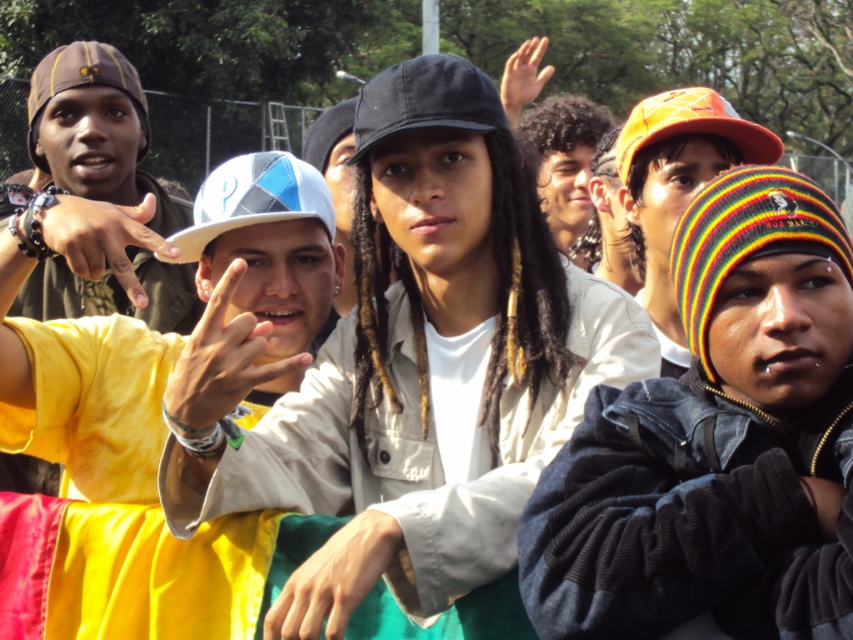
Does multicolor knitted beanie at center lie in front of black fabric baseball cap at center?

That is False.

How distant is multicolor knitted beanie at center from black fabric baseball cap at center?

multicolor knitted beanie at center is 1.24 meters away from black fabric baseball cap at center.

Between point (709, 154) and point (354, 109), which one is positioned behind?

The point (354, 109) is more distant.

The width and height of the screenshot is (853, 640). What are the coordinates of `multicolor knitted beanie at center` in the screenshot? It's located at (677, 179).

Is yellow cotton shirt at left to the left of matte brown beanie at left from the viewer's perspective?

No, yellow cotton shirt at left is not to the left of matte brown beanie at left.

Can you confirm if yellow cotton shirt at left is smaller than matte brown beanie at left?

No, yellow cotton shirt at left is not smaller than matte brown beanie at left.

Based on the photo, measure the distance between point (242,240) and camera.

14.71 feet

At what (x,y) coordinates should I click in order to perform the action: click on yellow cotton shirt at left. Please return your answer as a coordinate pair (x, y). Looking at the image, I should click on (88, 401).

Is point (206, 376) closer to viewer compared to point (381, 547)?

No, it is behind (381, 547).

Who is taller, matte yellow hand at center or smooth skin hand at center?

matte yellow hand at center

Is point (180, 412) positioned before point (335, 634)?

No, it is not.

You are a GUI agent. You are given a task and a screenshot of the screen. Output one action in this format:
    pyautogui.click(x=<x>, y=<y>)
    Task: Click on the matte yellow hand at center
    Image resolution: width=853 pixels, height=640 pixels.
    Given the screenshot: What is the action you would take?
    pyautogui.click(x=224, y=356)